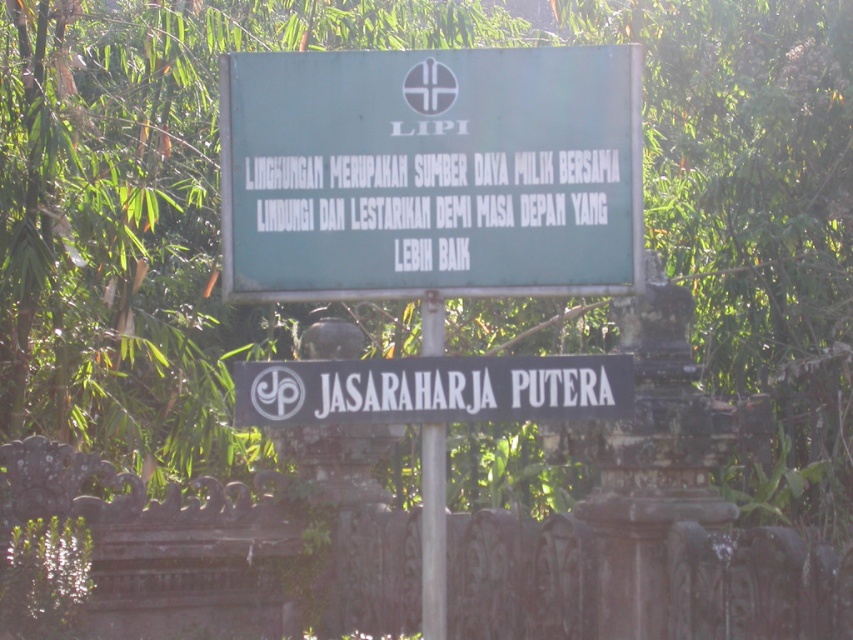
What is the location of the point at coordinates (430, 172) on the signboard?

The point at coordinates (430, 172) is located on the green matte signboard at center.

What is the spatial relationship between the green matte signboard at center and the metallic pole at center?

The green matte signboard at center is to the left of the metallic pole at center.

Based on the scene description, which point is closer to the viewer, point (396, 262) or point (432, 481)?

Point (396, 262) is in front of point (432, 481), so it is closer to the viewer.